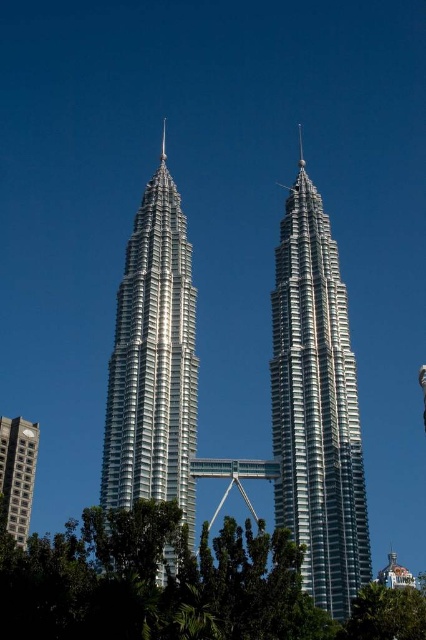
Question: Does green leafy tree at center appear under silver metallic spire at upper center?

Choices:
 (A) no
 (B) yes

Answer: (B)

Question: Is green leafy tree at center wider than silver metallic tower at center?

Choices:
 (A) yes
 (B) no

Answer: (A)

Question: Considering the real-world distances, which object is closest to the silver metallic building at center?

Choices:
 (A) green leafy tree at center
 (B) silver metallic spire at upper center

Answer: (A)

Question: Is silver metallic tower at center in front of silver metallic spire at upper center?

Choices:
 (A) yes
 (B) no

Answer: (A)

Question: Among these objects, which one is farthest from the camera?

Choices:
 (A) gray concrete building at lower left
 (B) green leafy tree at center
 (C) silver metallic building at center

Answer: (A)

Question: Which object appears farthest from the camera in this image?

Choices:
 (A) silver metallic building at center
 (B) silver metallic spire at upper center

Answer: (B)